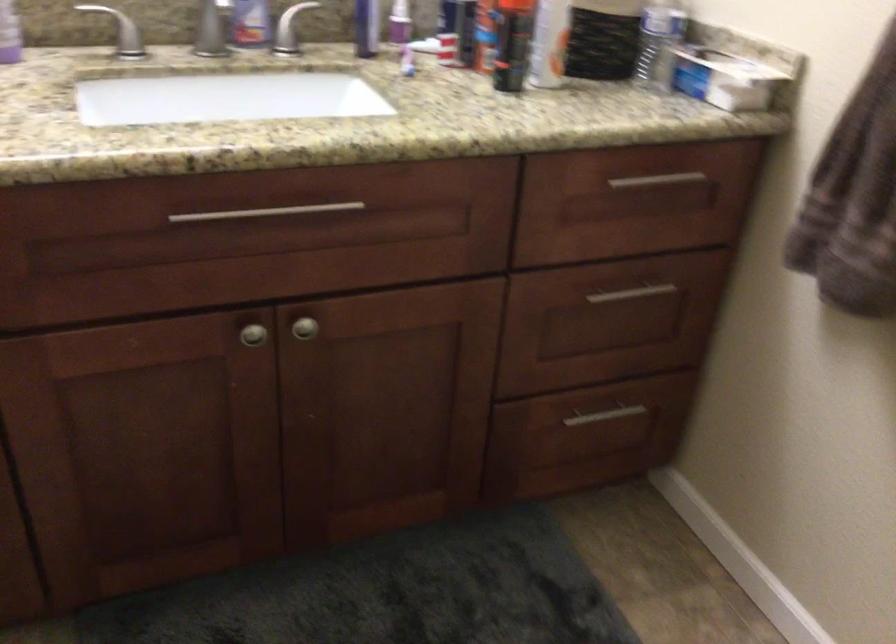
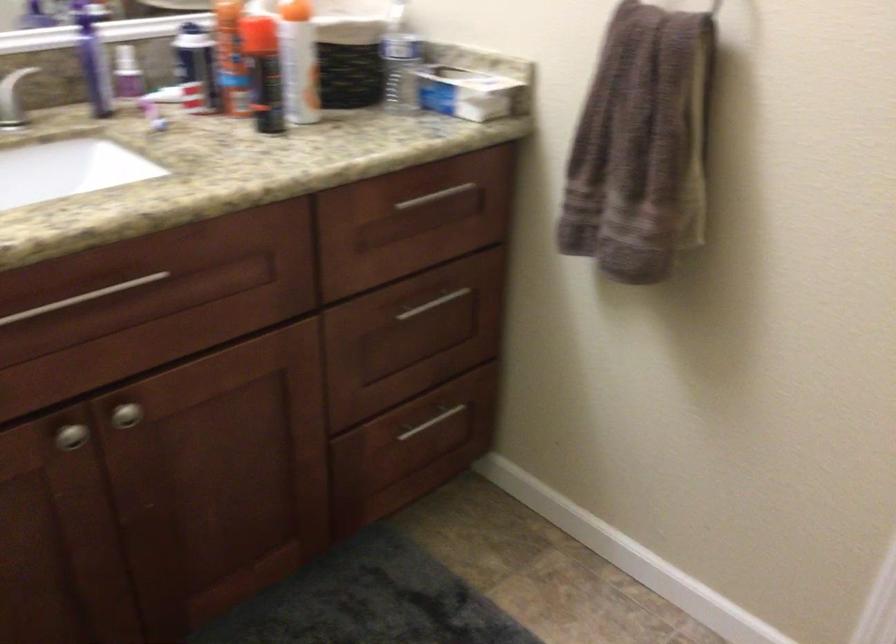
Find the pixel in the second image that matches (606,417) in the first image.

(432, 422)